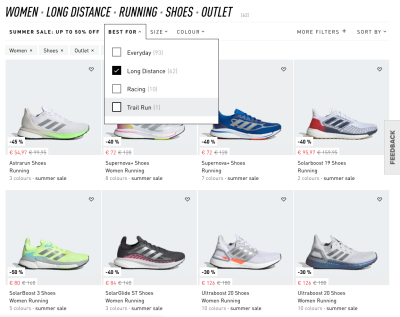
The image size is (400, 317). In order to click on drop down window in this screenshot , I will do `click(122, 22)`, `click(134, 122)`, `click(216, 81)`, `click(105, 86)`.